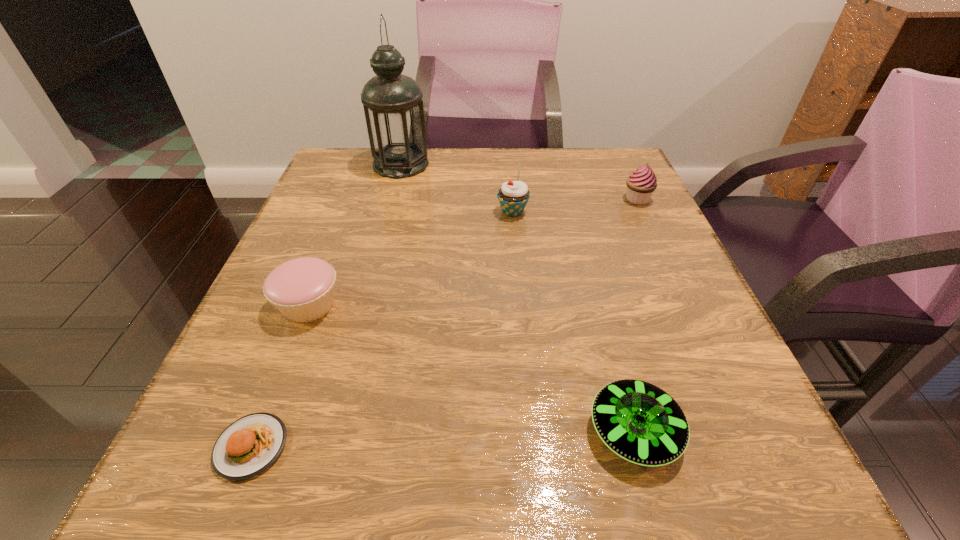
The height and width of the screenshot is (540, 960). What are the coordinates of `vacant area that lies between the third object from right to left and the farthest object` in the screenshot? It's located at (457, 188).

The image size is (960, 540). I want to click on free space between the second shortest object and the second cupcake from left to right, so click(x=573, y=322).

At what (x,y) coordinates should I click in order to perform the action: click on free space between the rightmost object and the leftmost cupcake. Please return your answer as a coordinate pair (x, y). The image size is (960, 540). Looking at the image, I should click on coord(473,252).

This screenshot has height=540, width=960. Identify the location of free point between the second object from right to left and the second cupcake from left to right. (573, 322).

Identify which object is the third closest to the shortest object. Please provide its 2D coordinates. Your answer should be formatted as a tuple, i.e. [(x, y)], where the tuple contains the x and y coordinates of a point satisfying the conditions above.

[(513, 196)]

The height and width of the screenshot is (540, 960). Identify the location of object that is the fourth nearest to the rightmost object. (302, 289).

This screenshot has height=540, width=960. I want to click on cupcake that is the closest to the second cupcake from right to left, so click(x=642, y=183).

Select which cupcake is the second closest to the third nearest object. Please provide its 2D coordinates. Your answer should be formatted as a tuple, i.e. [(x, y)], where the tuple contains the x and y coordinates of a point satisfying the conditions above.

[(642, 183)]

Identify the location of blank area in the image that satisfies the following two spatial constraints: 1. on the back side of the saucer; 2. on the right side of the rightmost cupcake. (571, 199).

Identify the location of vacant region that satisfies the following two spatial constraints: 1. on the back side of the fifth object from left to right; 2. on the right side of the food. The image size is (960, 540). (257, 431).